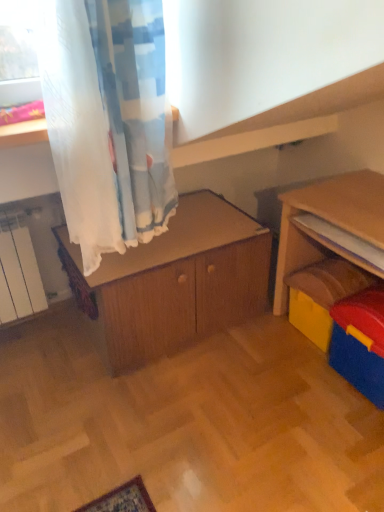
What is the approximate height of wooden cabinet at center?

The height of wooden cabinet at center is 57.34 centimeters.

The image size is (384, 512). I want to click on yellow plastic toy at right, so click(x=322, y=295).

Would you say yellow plastic toy at right is outside wooden bookshelf at right?

Yes, yellow plastic toy at right is located beyond the bounds of wooden bookshelf at right.

Is yellow plastic toy at right touching wooden bookshelf at right?

No, yellow plastic toy at right is not with wooden bookshelf at right.

Considering the relative sizes of yellow plastic toy at right and wooden bookshelf at right in the image provided, is yellow plastic toy at right wider than wooden bookshelf at right?

Yes, yellow plastic toy at right is wider than wooden bookshelf at right.

From the image's perspective, would you say yellow plastic toy at right is positioned over wooden bookshelf at right?

Actually, yellow plastic toy at right appears below wooden bookshelf at right in the image.

Would you say wooden cabinet at center contains wooden bookshelf at right?

No.

Which is more distant, (209, 227) or (346, 234)?

The point (209, 227) is more distant.

Is wooden cabinet at center facing away from wooden bookshelf at right?

wooden cabinet at center does not have its back to wooden bookshelf at right.

Does blue plastic storage box at lower right have a greater height compared to yellow plastic toy at right?

Correct, blue plastic storage box at lower right is much taller as yellow plastic toy at right.

Could you tell me if blue plastic storage box at lower right is turned towards yellow plastic toy at right?

No, blue plastic storage box at lower right is not aimed at yellow plastic toy at right.

Does blue plastic storage box at lower right have a lesser width compared to yellow plastic toy at right?

Yes.

Is blue plastic storage box at lower right with yellow plastic toy at right?

blue plastic storage box at lower right is not next to yellow plastic toy at right, and they're not touching.

From their relative heights in the image, would you say blue plastic storage box at lower right is taller or shorter than wooden bookshelf at right?

Considering their sizes, blue plastic storage box at lower right has more height than wooden bookshelf at right.

Is wooden bookshelf at right inside blue plastic storage box at lower right?

No, wooden bookshelf at right is not inside blue plastic storage box at lower right.

In the scene shown: Based on their positions, is blue plastic storage box at lower right located to the left or right of wooden bookshelf at right?

blue plastic storage box at lower right is positioned on wooden bookshelf at right's right side.

Is the depth of blue plastic storage box at lower right greater than that of wooden bookshelf at right?

No, the depth of blue plastic storage box at lower right is less than that of wooden bookshelf at right.

You are a GUI agent. You are given a task and a screenshot of the screen. Output one action in this format:
    pyautogui.click(x=<x>, y=<y>)
    Task: Click on the shelf lying in front of the yellow plastic toy at right
    This screenshot has width=384, height=512.
    Given the screenshot: What is the action you would take?
    pyautogui.click(x=342, y=243)

Can you tell me how much wooden bookshelf at right and yellow plastic toy at right differ in facing direction?

The angular difference between wooden bookshelf at right and yellow plastic toy at right is 0.998 degrees.

Considering the positions of objects wooden bookshelf at right and yellow plastic toy at right in the image provided, who is more to the left, wooden bookshelf at right or yellow plastic toy at right?

From the viewer's perspective, wooden bookshelf at right appears more on the left side.

Looking at this image, could you tell me if wooden bookshelf at right is facing wooden cabinet at center?

No, wooden bookshelf at right is not turned towards wooden cabinet at center.

Who is bigger, wooden bookshelf at right or wooden cabinet at center?

wooden cabinet at center is bigger.

In the scene shown: Considering the sizes of objects wooden bookshelf at right and wooden cabinet at center in the image provided, who is shorter, wooden bookshelf at right or wooden cabinet at center?

wooden bookshelf at right.

What's the angular difference between wooden cabinet at center and blue plastic storage box at lower right's facing directions?

89 degrees.

Looking at this image, from a real-world perspective, is wooden cabinet at center located beneath blue plastic storage box at lower right?

No, from a real-world perspective, wooden cabinet at center is not beneath blue plastic storage box at lower right.

Is wooden cabinet at center located outside blue plastic storage box at lower right?

Absolutely, wooden cabinet at center is external to blue plastic storage box at lower right.

Is wooden cabinet at center aimed at blue plastic storage box at lower right?

Yes, wooden cabinet at center is oriented towards blue plastic storage box at lower right.

Locate an element on the screen. This screenshot has width=384, height=512. shelf in front of the yellow plastic toy at right is located at coordinates (342, 243).

At what (x,y) coordinates should I click in order to perform the action: click on cabinetry behind the wooden bookshelf at right. Please return your answer as a coordinate pair (x, y). This screenshot has width=384, height=512. Looking at the image, I should click on (177, 282).

Considering their positions, is wooden cabinet at center positioned further to wooden bookshelf at right than yellow plastic toy at right?

The object further to wooden bookshelf at right is wooden cabinet at center.

Estimate the real-world distances between objects in this image. Which object is closer to wooden bookshelf at right, wooden cabinet at center or blue plastic storage box at lower right?

blue plastic storage box at lower right is positioned closer to the anchor wooden bookshelf at right.

From the image, which object appears to be farther from wooden cabinet at center, wooden bookshelf at right or blue plastic storage box at lower right?

blue plastic storage box at lower right.

Which object lies further to the anchor point blue plastic storage box at lower right, wooden bookshelf at right or wooden cabinet at center?

wooden cabinet at center is positioned further to the anchor blue plastic storage box at lower right.

Which object lies further to the anchor point wooden cabinet at center, yellow plastic toy at right or wooden bookshelf at right?

wooden bookshelf at right is further to wooden cabinet at center.

Estimate the real-world distances between objects in this image. Which object is closer to wooden bookshelf at right, blue plastic storage box at lower right or wooden cabinet at center?

blue plastic storage box at lower right is closer to wooden bookshelf at right.

Based on their spatial positions, is blue plastic storage box at lower right or yellow plastic toy at right closer to wooden bookshelf at right?

The object closer to wooden bookshelf at right is blue plastic storage box at lower right.

Considering their positions, is wooden cabinet at center positioned further to yellow plastic toy at right than wooden bookshelf at right?

wooden cabinet at center is further to yellow plastic toy at right.

Locate an element on the screen. The height and width of the screenshot is (512, 384). toy located between wooden cabinet at center and blue plastic storage box at lower right in the left-right direction is located at coordinates (322, 295).

You are a GUI agent. You are given a task and a screenshot of the screen. Output one action in this format:
    pyautogui.click(x=<x>, y=<y>)
    Task: Click on the shelf between wooden cabinet at center and blue plastic storage box at lower right in the horizontal direction
    
    Given the screenshot: What is the action you would take?
    pyautogui.click(x=342, y=243)

This screenshot has height=512, width=384. Find the location of `toy that lies between wooden bookshelf at right and blue plastic storage box at lower right from top to bottom`. toy that lies between wooden bookshelf at right and blue plastic storage box at lower right from top to bottom is located at coordinates (322, 295).

The height and width of the screenshot is (512, 384). Identify the location of shelf between wooden cabinet at center and yellow plastic toy at right. (342, 243).